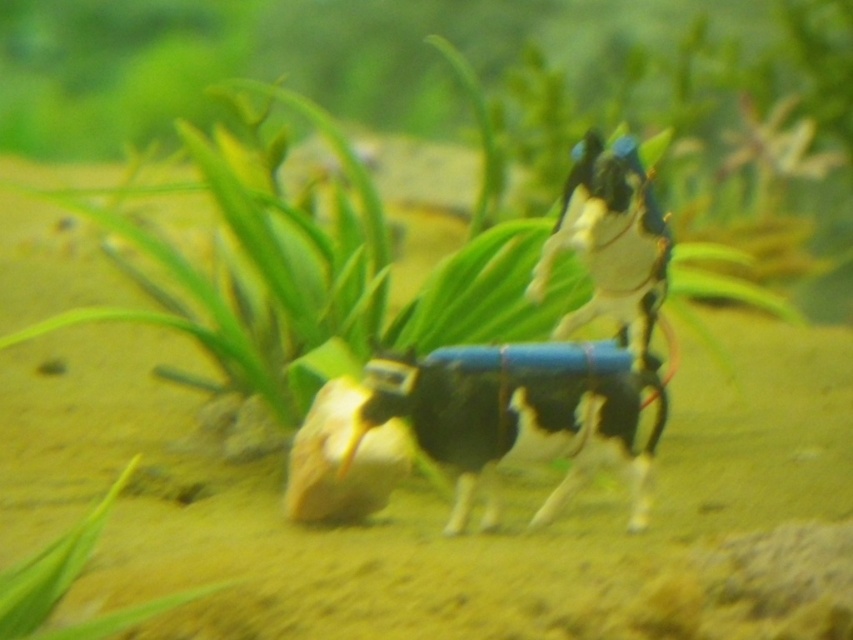
Which is more to the left, black matte cow at center or shiny blue plastic crab at center?

From the viewer's perspective, black matte cow at center appears more on the left side.

Between point (572, 449) and point (602, 280), which one is positioned behind?

Point (602, 280)

Locate an element on the screen. Image resolution: width=853 pixels, height=640 pixels. black matte cow at center is located at coordinates (517, 419).

Can you confirm if shiny blue plastic crab at center is positioned above green leafy plant at lower left?

Yes.

Between shiny blue plastic crab at center and green leafy plant at lower left, which one appears on the left side from the viewer's perspective?

green leafy plant at lower left is more to the left.

Is point (660, 269) farther from camera compared to point (53, 577)?

Yes, point (660, 269) is farther from viewer.

Where is `shiny blue plastic crab at center`? The width and height of the screenshot is (853, 640). shiny blue plastic crab at center is located at coordinates (612, 243).

Does black matte cow at center have a lesser height compared to green leafy plant at lower left?

No.

Measure the distance between black matte cow at center and camera.

black matte cow at center and camera are 1.52 meters apart.

Between point (465, 470) and point (83, 563), which one is positioned in front?

Point (83, 563) is in front.

This screenshot has height=640, width=853. Find the location of `black matte cow at center`. black matte cow at center is located at coordinates (517, 419).